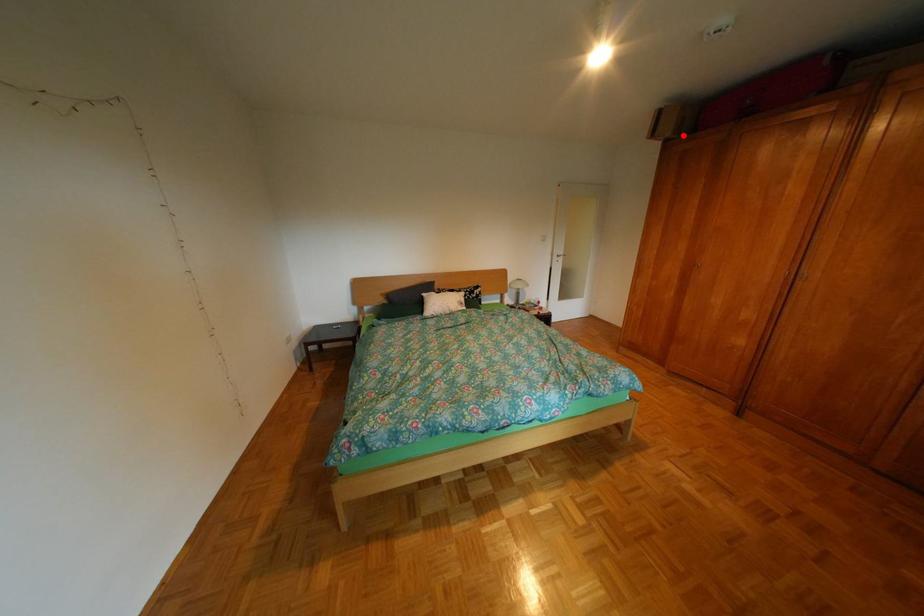
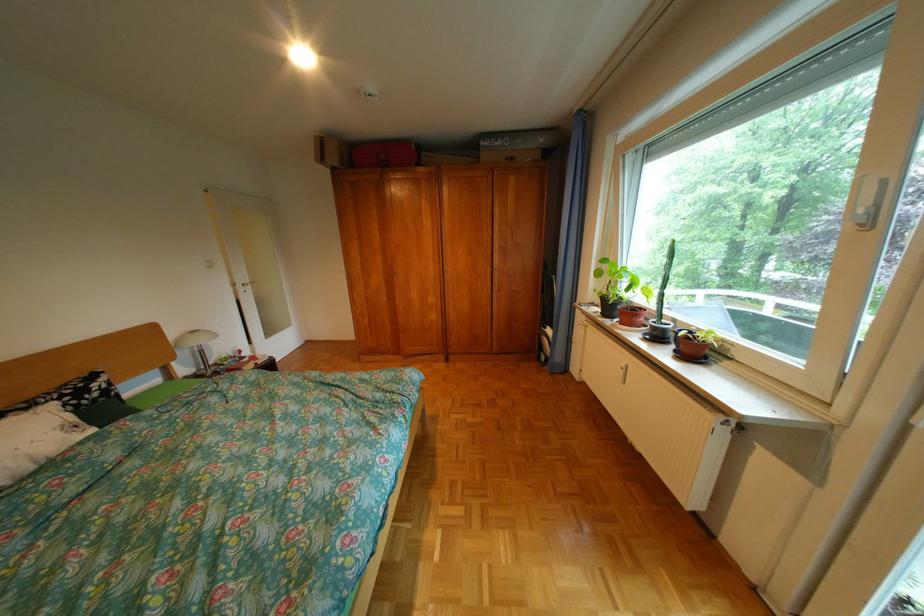
In the second image, find the point that corresponds to the highlighted location in the first image.

(350, 164)